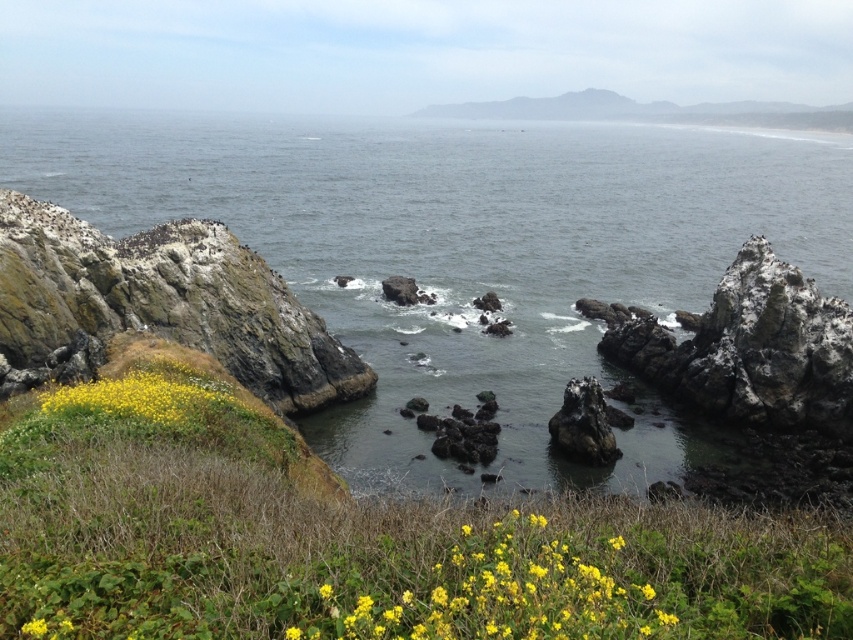
Question: Which of these objects is positioned farthest from the yellow matte flowers at lower center?

Choices:
 (A) yellow matte flower at lower center
 (B) rusty stone cliff at left

Answer: (B)

Question: Does yellow matte flowers at lower center appear over yellow matte flowers at lower left?

Choices:
 (A) no
 (B) yes

Answer: (A)

Question: Based on their relative distances, which object is farther from the gray/rocky water at center?

Choices:
 (A) yellow matte flowers at lower center
 (B) yellow matte flowers at lower left
 (C) yellow matte flower at lower left
 (D) rough textured rock at center

Answer: (B)

Question: Does rusty stone cliff at left appear over yellow matte flowers at lower left?

Choices:
 (A) no
 (B) yes

Answer: (B)

Question: Does rough textured rock at center have a larger size compared to yellow matte flower at lower center?

Choices:
 (A) yes
 (B) no

Answer: (A)

Question: Which object is positioned farthest from the yellow matte flower at lower left?

Choices:
 (A) yellow matte flowers at lower left
 (B) rough textured rock at center
 (C) yellow matte flower at lower center

Answer: (B)